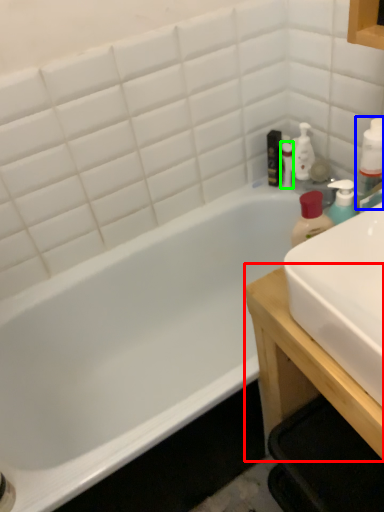
Question: Which is nearer to the table (highlighted by a red box)? bottle (highlighted by a blue box) or toiletry (highlighted by a green box).

Choices:
 (A) bottle
 (B) toiletry

Answer: (A)